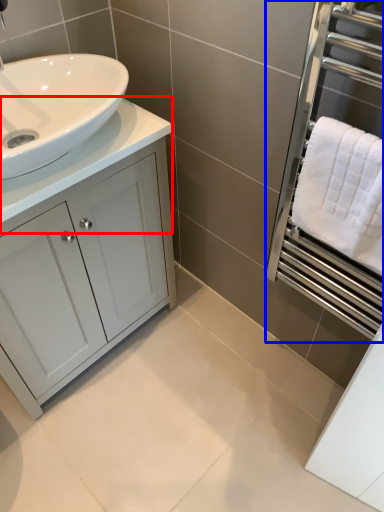
Question: Which object is closer to the camera taking this photo, counter top (highlighted by a red box) or screen door (highlighted by a blue box)?

Choices:
 (A) counter top
 (B) screen door

Answer: (B)